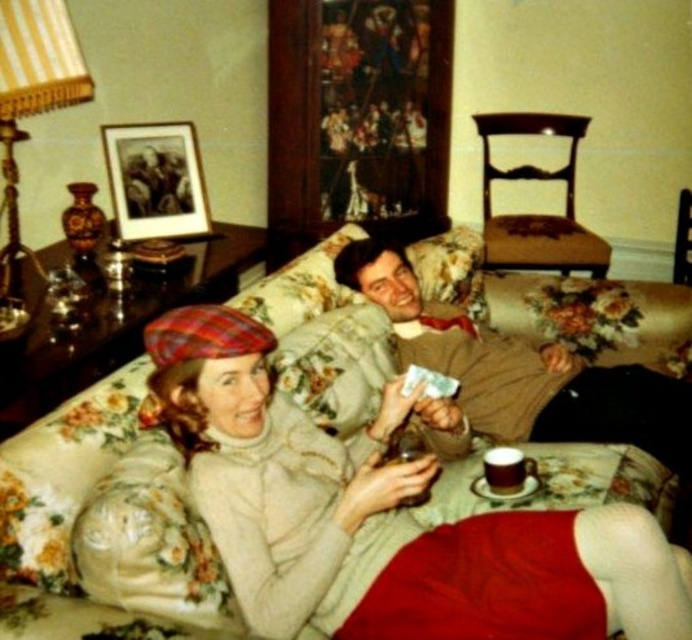
Is light brown wool sweater at center bigger than matte plastic cup at lower center?

Indeed, light brown wool sweater at center has a larger size compared to matte plastic cup at lower center.

Which is in front, point (527, 349) or point (406, 461)?

Positioned in front is point (406, 461).

Identify the location of light brown wool sweater at center. (522, 371).

Can you confirm if matte ceramic cup at lower center is taller than matte plastic cup at lower center?

In fact, matte ceramic cup at lower center may be shorter than matte plastic cup at lower center.

The height and width of the screenshot is (640, 692). In order to click on matte ceramic cup at lower center in this screenshot , I will do `click(507, 470)`.

Between point (518, 481) and point (383, 461), which one is positioned in front?

Positioned in front is point (383, 461).

Find the location of a particular element. matte ceramic cup at lower center is located at coordinates (507, 470).

Between point (495, 259) and point (677, 246), which one is positioned behind?

The point (495, 259) is behind.

Describe the element at coordinates (537, 214) in the screenshot. This screenshot has height=640, width=692. I see `brown fabric armchair at upper right` at that location.

This screenshot has width=692, height=640. I want to click on brown fabric armchair at upper right, so click(537, 214).